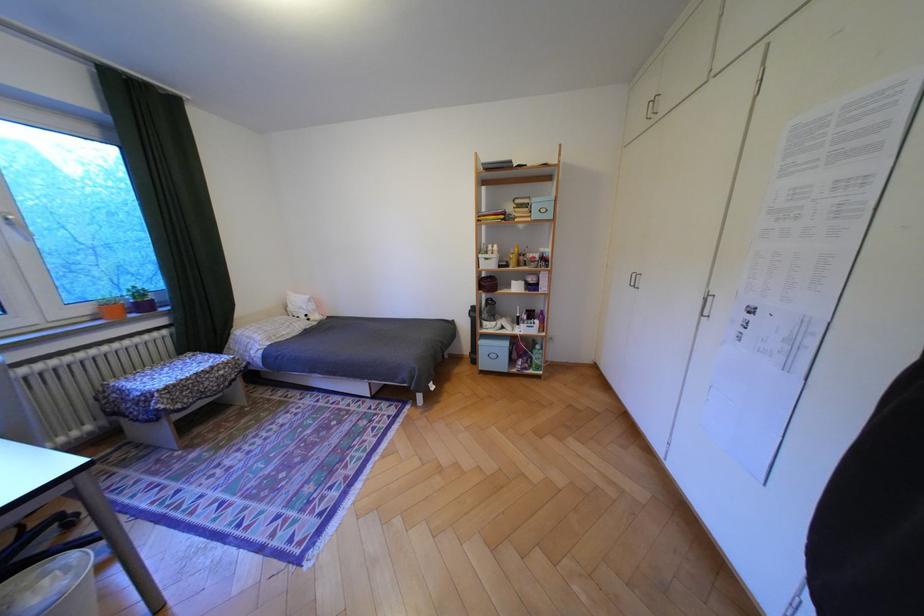
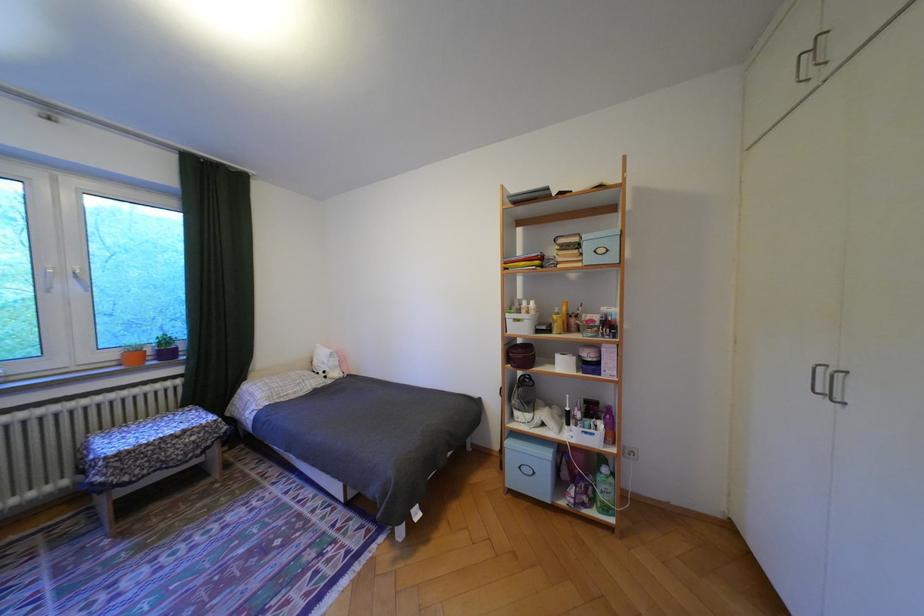
The images are taken continuously from a first-person perspective. In which direction are you moving?

The cameraman walked toward right, forward.